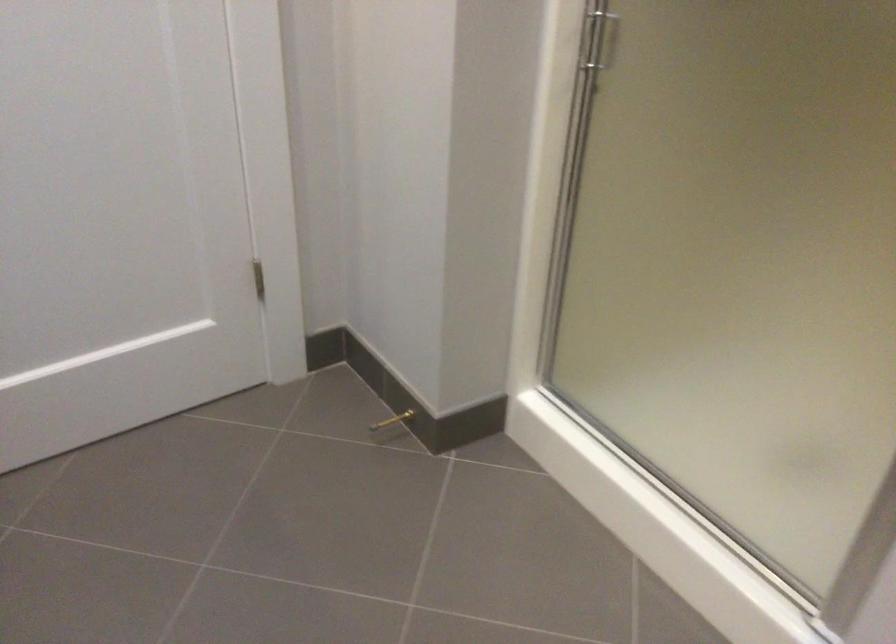
Describe the element at coordinates (596, 39) in the screenshot. I see `a silver shower door handle` at that location.